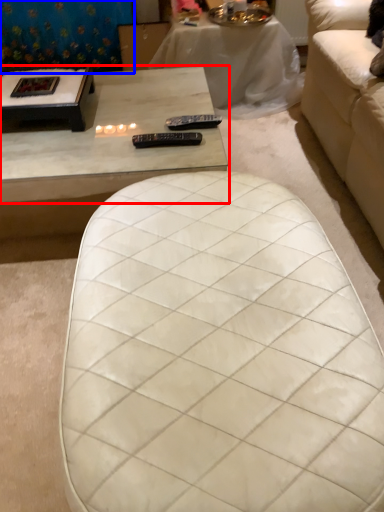
Question: Which object appears closest to the camera in this image, coffee table (highlighted by a red box) or curtain (highlighted by a blue box)?

Choices:
 (A) coffee table
 (B) curtain

Answer: (A)